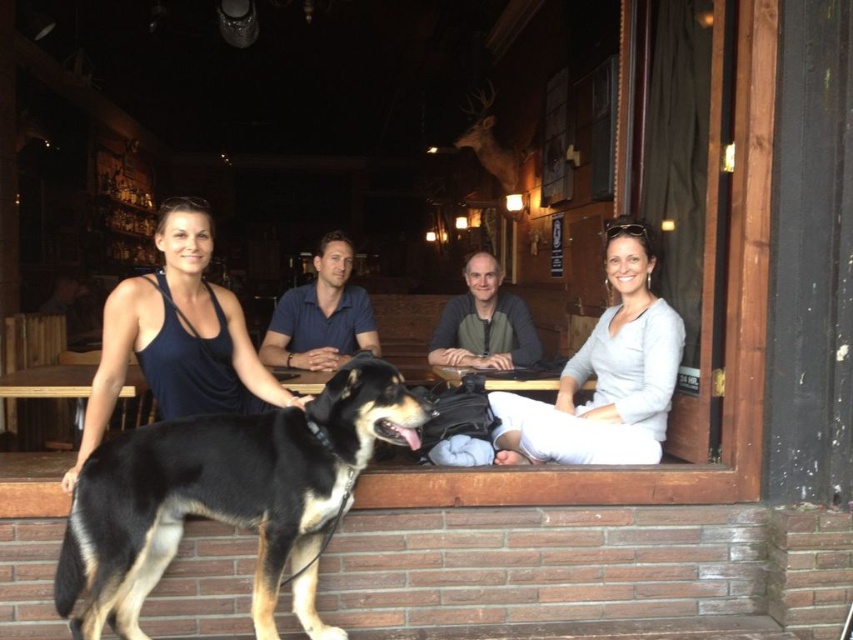
Question: Which point is farther to the camera?

Choices:
 (A) light gray sweater at center
 (B) wooden frame at center

Answer: (A)

Question: Which object is the farthest from the light gray sweater at center?

Choices:
 (A) matte black tank top at center
 (B) wooden frame at center
 (C) gray knit sweater at center
 (D) blue cotton shirt at center

Answer: (A)

Question: Is black and tan fur dog at left thinner than light gray sweater at center?

Choices:
 (A) yes
 (B) no

Answer: (B)

Question: Among these points, which one is farthest from the camera?

Choices:
 (A) coord(248,428)
 (B) coord(503,294)
 (C) coord(105,385)
 (D) coord(624,289)

Answer: (B)

Question: Is black and tan fur dog at left closer to camera compared to light gray sweater at center?

Choices:
 (A) no
 (B) yes

Answer: (B)

Question: Does wooden frame at center appear on the right side of light gray sweater at center?

Choices:
 (A) no
 (B) yes

Answer: (B)